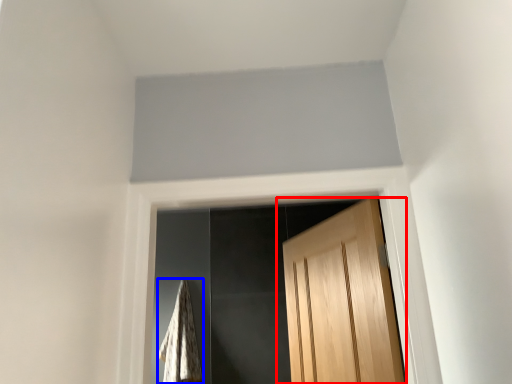
Question: Which point is closer to the camera, door (highlighted by a red box) or blanket (highlighted by a blue box)?

Choices:
 (A) door
 (B) blanket

Answer: (A)